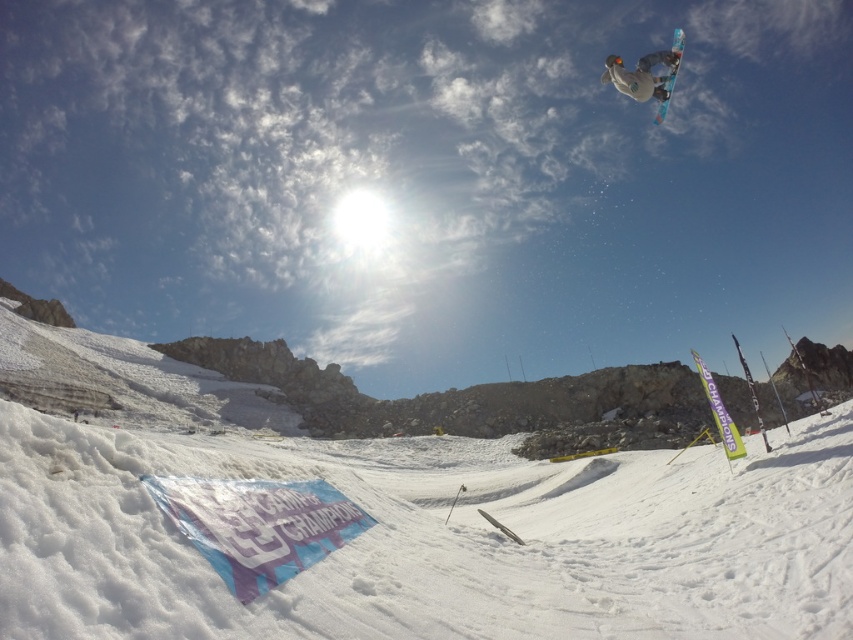
Between white fluffy snow at lower center and white matte snowboarder at upper right, which one has less height?

Standing shorter between the two is white matte snowboarder at upper right.

Is point (730, 600) less distant than point (605, 60)?

Yes.

You are a GUI agent. You are given a task and a screenshot of the screen. Output one action in this format:
    pyautogui.click(x=<x>, y=<y>)
    Task: Click on the white fluffy snow at lower center
    
    Given the screenshot: What is the action you would take?
    pyautogui.click(x=434, y=541)

Image resolution: width=853 pixels, height=640 pixels. What are the coordinates of `white fluffy snow at lower center` in the screenshot? It's located at (434, 541).

Can you confirm if white matte snowboarder at upper right is smaller than blue glossy snowboard at upper right?

Yes, white matte snowboarder at upper right is smaller than blue glossy snowboard at upper right.

Looking at this image, can you confirm if white matte snowboarder at upper right is positioned to the right of blue glossy snowboard at upper right?

In fact, white matte snowboarder at upper right is to the left of blue glossy snowboard at upper right.

Does point (660, 99) lie behind point (676, 35)?

No.

This screenshot has width=853, height=640. Identify the location of white matte snowboarder at upper right. (639, 76).

Who is positioned more to the left, white fluffy snow at lower center or blue glossy snowboard at upper right?

Positioned to the left is white fluffy snow at lower center.

Between point (105, 497) and point (659, 104), which one is positioned behind?

The point (659, 104) is more distant.

Where is `white fluffy snow at lower center`? white fluffy snow at lower center is located at coordinates (434, 541).